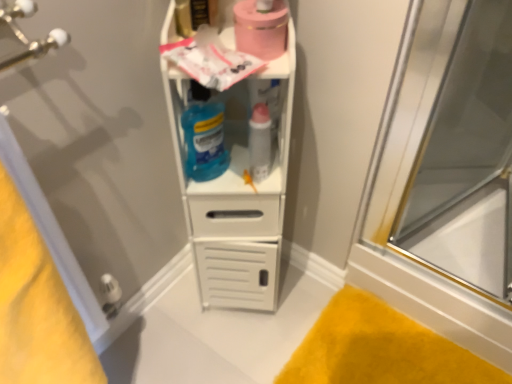
Question: Would you say white plastic shelf at center is to the left or to the right of pink matte toilet paper at upper center in the picture?

Choices:
 (A) right
 (B) left

Answer: (B)

Question: Considering the positions of white plastic shelf at center and pink matte toilet paper at upper center in the image, is white plastic shelf at center wider or thinner than pink matte toilet paper at upper center?

Choices:
 (A) thin
 (B) wide

Answer: (B)

Question: Estimate the real-world distances between objects in this image. Which object is closer to the transparent glass door at right?

Choices:
 (A) translucent blue liquid at center
 (B) white plastic shelf at center
 (C) transparent glass screen door at left
 (D) pink matte toilet paper at upper center
 (E) yellow plush bath mat at lower right

Answer: (E)

Question: Considering the real-world distances, which object is farthest from the yellow fabric towel at lower left?

Choices:
 (A) white plastic shelf at center
 (B) transparent glass screen door at left
 (C) transparent glass door at right
 (D) translucent blue liquid at center
 (E) yellow plush bath mat at lower right

Answer: (C)